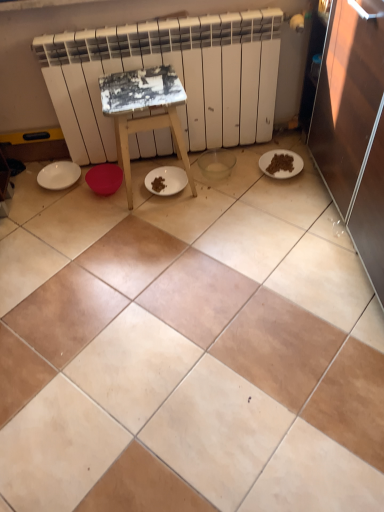
The height and width of the screenshot is (512, 384). Find the location of `vacant area on top of white painted wood stool at center (from a real-world perspective)`. vacant area on top of white painted wood stool at center (from a real-world perspective) is located at coordinates (137, 85).